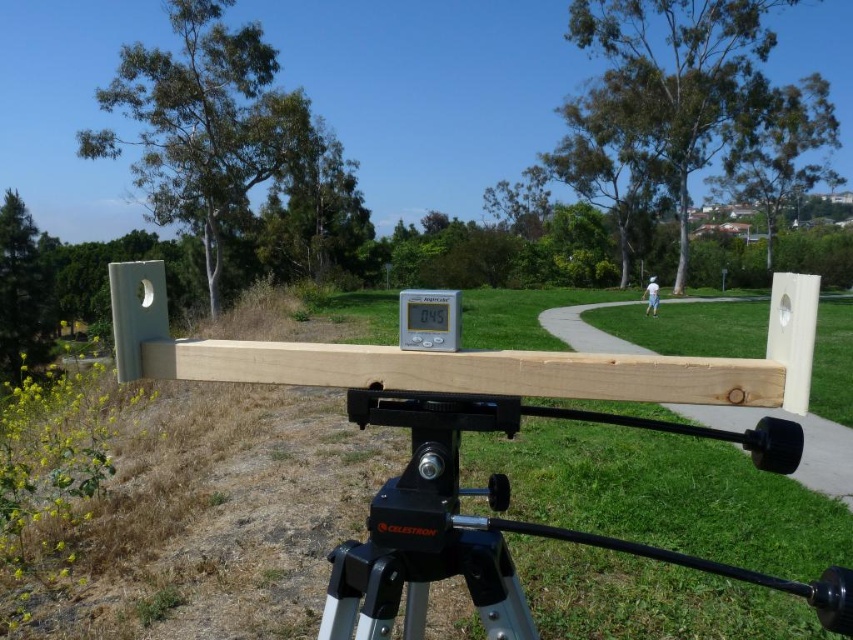
Between black metal tripod at center and natural wood plank at center, which one appears on the left side from the viewer's perspective?

Positioned to the left is natural wood plank at center.

Where is `black metal tripod at center`? The width and height of the screenshot is (853, 640). black metal tripod at center is located at coordinates (503, 520).

At what (x,y) coordinates should I click in order to perform the action: click on black metal tripod at center. Please return your answer as a coordinate pair (x, y). This screenshot has width=853, height=640. Looking at the image, I should click on (503, 520).